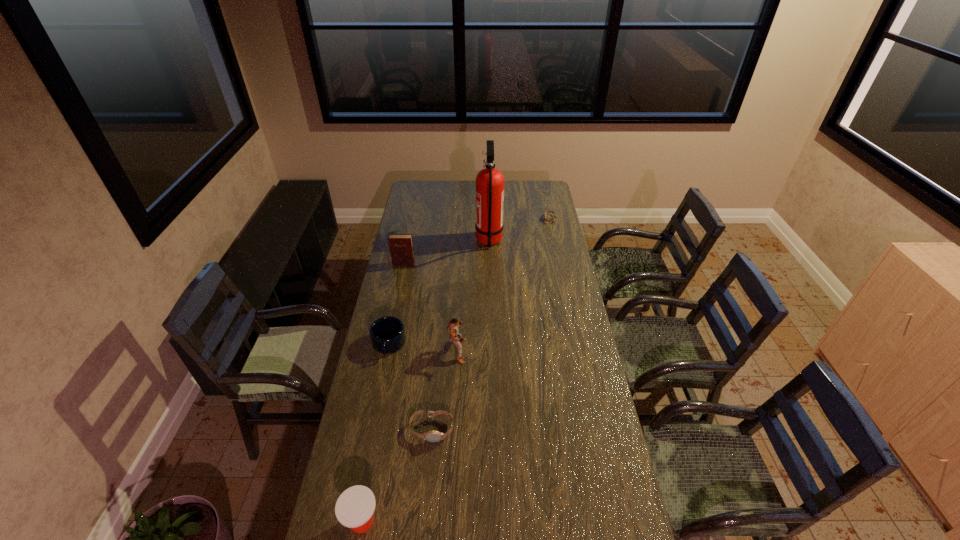
The image size is (960, 540). In order to click on free point between the fifth tallest object and the second farthest object in this screenshot , I will do `click(439, 293)`.

Where is `vacant region between the nearer watch and the farthest object`? vacant region between the nearer watch and the farthest object is located at coordinates (491, 324).

The height and width of the screenshot is (540, 960). In order to click on object that is the fifth closest to the sixth object from left to right in this screenshot , I will do `click(432, 436)`.

Find the location of `object that is the nearest to the second nearest object`. object that is the nearest to the second nearest object is located at coordinates (355, 507).

You are a GUI agent. You are given a task and a screenshot of the screen. Output one action in this format:
    pyautogui.click(x=<x>, y=<y>)
    Task: Click on the vacant space that satisfies the following two spatial constraints: 1. on the face of the rightmost object; 2. on the front cover of the diary
    The width and height of the screenshot is (960, 540).
    Given the screenshot: What is the action you would take?
    pyautogui.click(x=559, y=264)

I want to click on vacant space that satisfies the following two spatial constraints: 1. on the handle side of the tallest object; 2. on the face of the second nearest object, so click(494, 429).